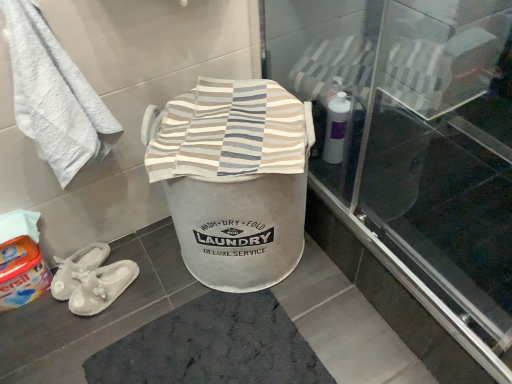
The image size is (512, 384). What do you see at coordinates (229, 133) in the screenshot? I see `striped cotton laundry basket at center` at bounding box center [229, 133].

Where is `white fabric laundry basket at center`? The image size is (512, 384). white fabric laundry basket at center is located at coordinates (234, 179).

Is orange fabric detergent at lower left facing towards striped cotton laundry basket at center?

No, orange fabric detergent at lower left is not facing towards striped cotton laundry basket at center.

From a real-world perspective, is orange fabric detergent at lower left physically located above or below striped cotton laundry basket at center?

Clearly, from a real-world perspective, orange fabric detergent at lower left is below striped cotton laundry basket at center.

From the image's perspective, between orange fabric detergent at lower left and striped cotton laundry basket at center, which one is located above?

striped cotton laundry basket at center, from the image's perspective.

Does point (196, 327) come behind point (17, 291)?

No, it is not.

Is dark gray textured bath mat at center directly adjacent to orange fabric detergent at lower left?

No.

From the picture: Is dark gray textured bath mat at center taller than orange fabric detergent at lower left?

Incorrect, the height of dark gray textured bath mat at center is not larger of that of orange fabric detergent at lower left.

Does white soft towel at upper left come in front of striped cotton laundry basket at center?

Yes, white soft towel at upper left is in front of striped cotton laundry basket at center.

Considering the sizes of white soft towel at upper left and striped cotton laundry basket at center in the image, is white soft towel at upper left bigger or smaller than striped cotton laundry basket at center?

Clearly, white soft towel at upper left is larger in size than striped cotton laundry basket at center.

Is white soft towel at upper left inside or outside of striped cotton laundry basket at center?

white soft towel at upper left is not enclosed by striped cotton laundry basket at center.

Where is `beach towel behind the white soft towel at upper left`? Image resolution: width=512 pixels, height=384 pixels. beach towel behind the white soft towel at upper left is located at coordinates (229, 133).

In the scene shown: Which object is wider, striped cotton laundry basket at center or dark gray textured bath mat at center?

Wider between the two is dark gray textured bath mat at center.

Is striped cotton laundry basket at center spatially inside dark gray textured bath mat at center, or outside of it?

striped cotton laundry basket at center is outside dark gray textured bath mat at center.

Which is farther from the camera, (x=203, y=122) or (x=188, y=303)?

The point (x=188, y=303) is farther.

From the picture: Could you tell me if striped cotton laundry basket at center is turned towards dark gray textured bath mat at center?

No, striped cotton laundry basket at center does not turn towards dark gray textured bath mat at center.

From a real-world perspective, is striped cotton laundry basket at center on transparent glass screen door at upper center?

No, from a real-world perspective, striped cotton laundry basket at center is not over transparent glass screen door at upper center

Considering the relative positions of striped cotton laundry basket at center and transparent glass screen door at upper center in the image provided, is striped cotton laundry basket at center to the left of transparent glass screen door at upper center from the viewer's perspective?

Indeed, striped cotton laundry basket at center is positioned on the left side of transparent glass screen door at upper center.

Is striped cotton laundry basket at center with transparent glass screen door at upper center?

No, striped cotton laundry basket at center is not beside transparent glass screen door at upper center.

The image size is (512, 384). I want to click on screen door on the right of striped cotton laundry basket at center, so click(x=415, y=158).

Considering the sizes of objects white soft towel at upper left and orange fabric detergent at lower left in the image provided, who is shorter, white soft towel at upper left or orange fabric detergent at lower left?

With less height is orange fabric detergent at lower left.

Is there a large distance between white soft towel at upper left and orange fabric detergent at lower left?

No, white soft towel at upper left is not far from orange fabric detergent at lower left.

Looking at the image, does white soft towel at upper left seem bigger or smaller compared to orange fabric detergent at lower left?

In the image, white soft towel at upper left appears to be larger than orange fabric detergent at lower left.

Is white soft towel at upper left in front of or behind orange fabric detergent at lower left in the image?

In the image, white soft towel at upper left appears in front of orange fabric detergent at lower left.

How distant is white fabric laundry basket at center from striped cotton laundry basket at center?

white fabric laundry basket at center and striped cotton laundry basket at center are 3.23 inches apart.

Does white fabric laundry basket at center turn towards striped cotton laundry basket at center?

No, white fabric laundry basket at center is not aimed at striped cotton laundry basket at center.

Identify the location of writing that appears below the striped cotton laundry basket at center (from the image's perspective). (234, 179).

In the scene shown: Considering the sizes of objects white fabric laundry basket at center and striped cotton laundry basket at center in the image provided, who is shorter, white fabric laundry basket at center or striped cotton laundry basket at center?

striped cotton laundry basket at center.

The image size is (512, 384). In order to click on beach towel on the right of orange fabric detergent at lower left in this screenshot , I will do `click(229, 133)`.

Where is `bath mat in front of the orange fabric detergent at lower left`? The image size is (512, 384). bath mat in front of the orange fabric detergent at lower left is located at coordinates (212, 347).

When comparing their distances from white soft towel at upper left, does dark gray textured bath mat at center or orange fabric detergent at lower left seem closer?

orange fabric detergent at lower left lies closer to white soft towel at upper left than the other object.

From the image, which object appears to be nearer to orange fabric detergent at lower left, striped cotton laundry basket at center or dark gray textured bath mat at center?

dark gray textured bath mat at center is positioned closer to the anchor orange fabric detergent at lower left.

When comparing their distances from white fabric laundry basket at center, does striped cotton laundry basket at center or white soft towel at upper left seem further?

Based on the image, white soft towel at upper left appears to be further to white fabric laundry basket at center.

Looking at the image, which one is located further to white fabric laundry basket at center, white soft towel at upper left or transparent glass screen door at upper center?

The object further to white fabric laundry basket at center is transparent glass screen door at upper center.

From the image, which object appears to be nearer to dark gray textured bath mat at center, transparent glass screen door at upper center or orange fabric detergent at lower left?

The object closer to dark gray textured bath mat at center is orange fabric detergent at lower left.

Estimate the real-world distances between objects in this image. Which object is further from white soft towel at upper left, white fabric slippers at lower left or dark gray textured bath mat at center?

dark gray textured bath mat at center lies further to white soft towel at upper left than the other object.

Looking at the image, which one is located closer to white fabric slippers at lower left, orange fabric detergent at lower left or white fabric laundry basket at center?

orange fabric detergent at lower left lies closer to white fabric slippers at lower left than the other object.

From the image, which object appears to be nearer to white fabric laundry basket at center, white fabric slippers at lower left or transparent glass screen door at upper center?

Based on the image, transparent glass screen door at upper center appears to be nearer to white fabric laundry basket at center.

I want to click on towel located between orange fabric detergent at lower left and transparent glass screen door at upper center in the left-right direction, so click(53, 95).

The width and height of the screenshot is (512, 384). I want to click on beach towel between transparent glass screen door at upper center and white fabric slippers at lower left in the front-back direction, so click(229, 133).

The width and height of the screenshot is (512, 384). I want to click on beach towel located between white soft towel at upper left and white fabric laundry basket at center in the left-right direction, so click(x=229, y=133).

This screenshot has width=512, height=384. Find the location of `footwear between white soft towel at upper left and dark gray textured bath mat at center in the up-down direction`. footwear between white soft towel at upper left and dark gray textured bath mat at center in the up-down direction is located at coordinates tap(101, 287).